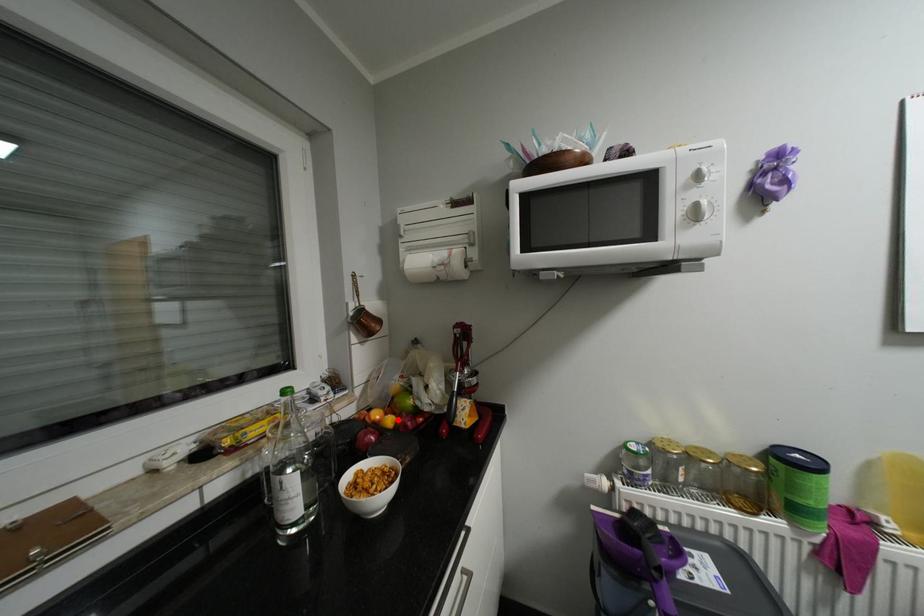
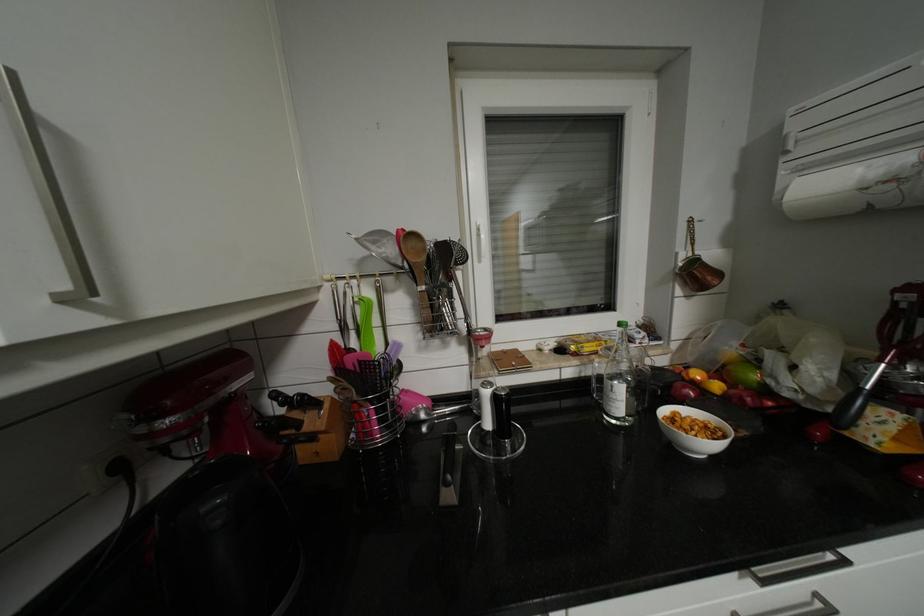
The point at the highlighted location is marked in the first image. Where is the corresponding point in the second image?

(724, 386)